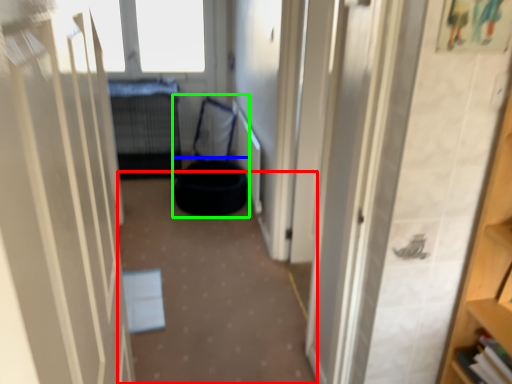
Question: Based on their relative distances, which object is nearer to corridor (highlighted by a red box)? Choose from bean bag chair (highlighted by a blue box) and bean bag chair (highlighted by a green box).

Choices:
 (A) bean bag chair
 (B) bean bag chair

Answer: (A)